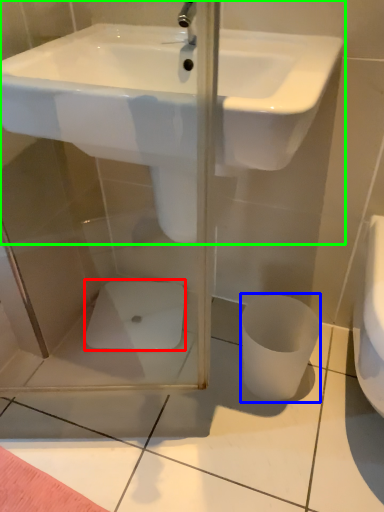
Question: Which object is the farthest from porcelain (highlighted by a red box)? Choose among these: toilet bowl (highlighted by a blue box) or sink (highlighted by a green box).

Choices:
 (A) toilet bowl
 (B) sink

Answer: (B)